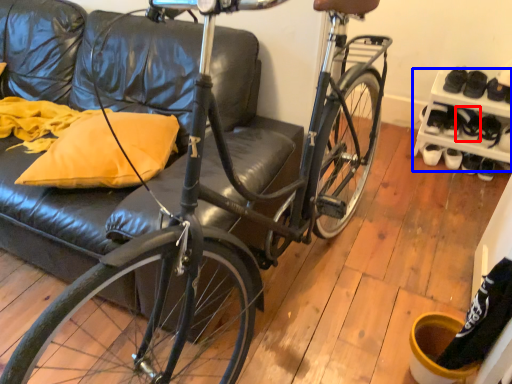
Question: Which point is further to the camera, shoe (highlighted by a red box) or shelf (highlighted by a blue box)?

Choices:
 (A) shoe
 (B) shelf

Answer: (A)